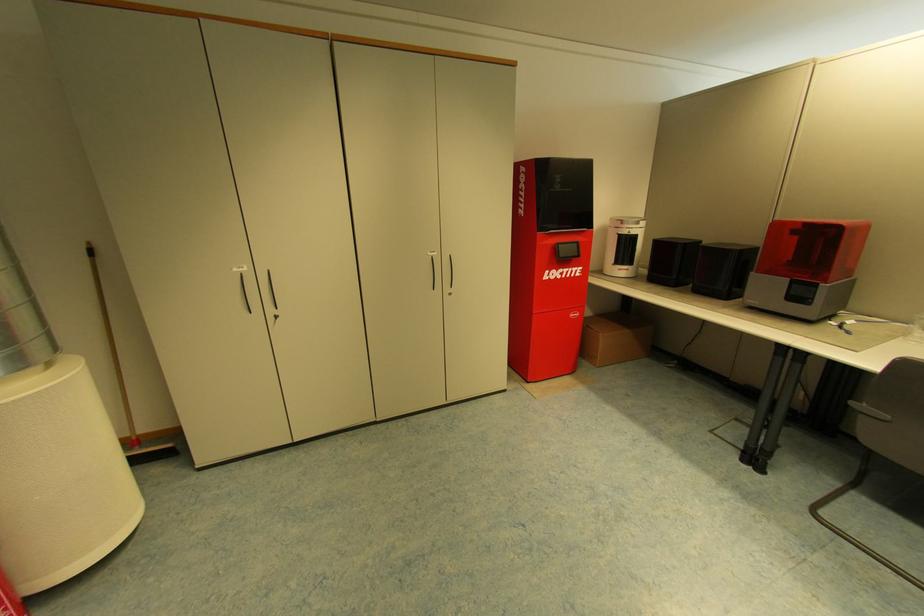
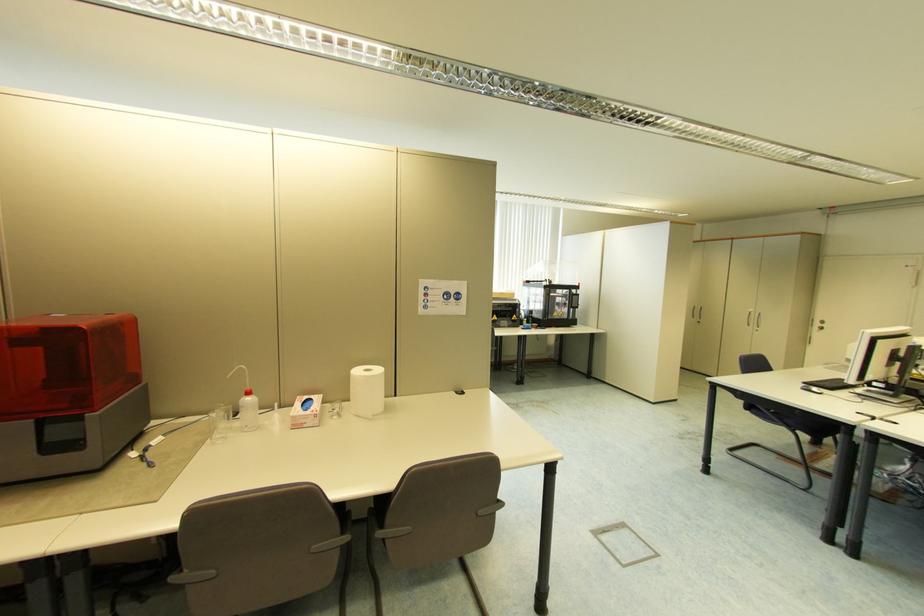
Question: How did the camera likely rotate?

Choices:
 (A) Left
 (B) Right
 (C) Up
 (D) Down

Answer: (B)